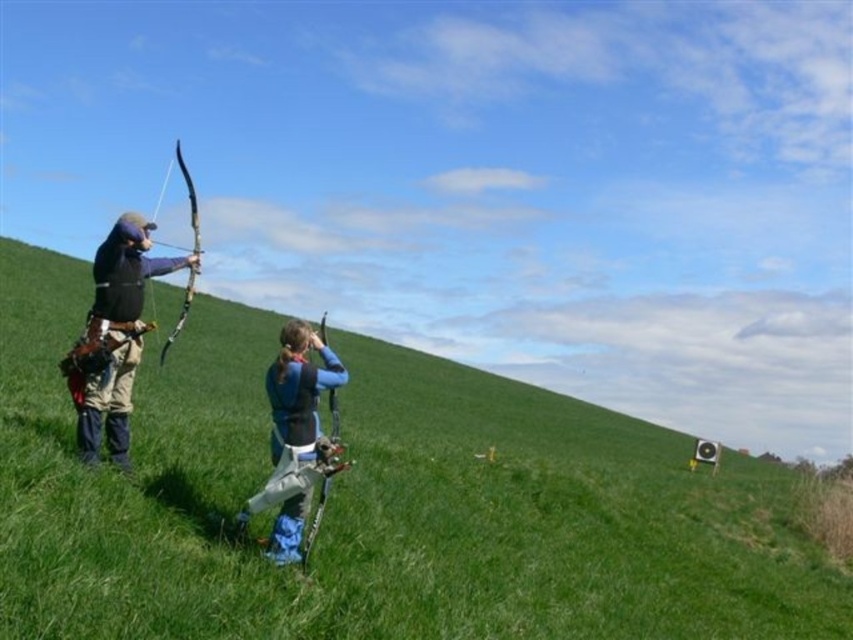
Which of these two, green grassy hillside at center or wooden bow at left, stands shorter?

With less height is wooden bow at left.

Which is above, green grassy hillside at center or wooden bow at left?

wooden bow at left is above.

This screenshot has height=640, width=853. In order to click on green grassy hillside at center in this screenshot , I will do `click(375, 502)`.

Where is `blue fabric jacket at center`? blue fabric jacket at center is located at coordinates (294, 435).

Between blue fabric jacket at center and wooden bow at left, which one is positioned lower?

blue fabric jacket at center is lower down.

Where is `blue fabric jacket at center`? blue fabric jacket at center is located at coordinates click(x=294, y=435).

Locate an element on the screen. Image resolution: width=853 pixels, height=640 pixels. blue fabric jacket at center is located at coordinates (294, 435).

Is green grassy hillside at center thinner than matte black archery bow at left?

Incorrect, green grassy hillside at center's width is not less than matte black archery bow at left's.

Is green grassy hillside at center taller than matte black archery bow at left?

Indeed, green grassy hillside at center has a greater height compared to matte black archery bow at left.

Who is more distant from viewer, (398,372) or (115,252)?

Point (398,372)

Where is `green grassy hillside at center`? This screenshot has height=640, width=853. green grassy hillside at center is located at coordinates (375, 502).